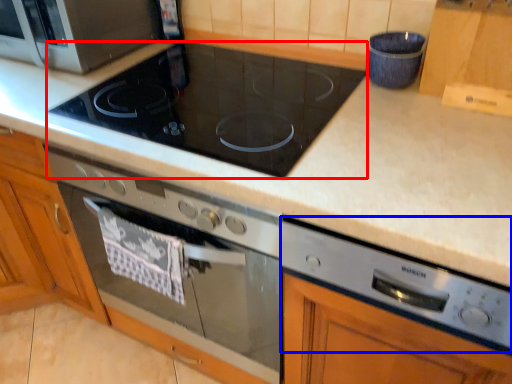
Question: Among these objects, which one is farthest to the camera, gas stove (highlighted by a red box) or appliance (highlighted by a blue box)?

Choices:
 (A) gas stove
 (B) appliance

Answer: (A)